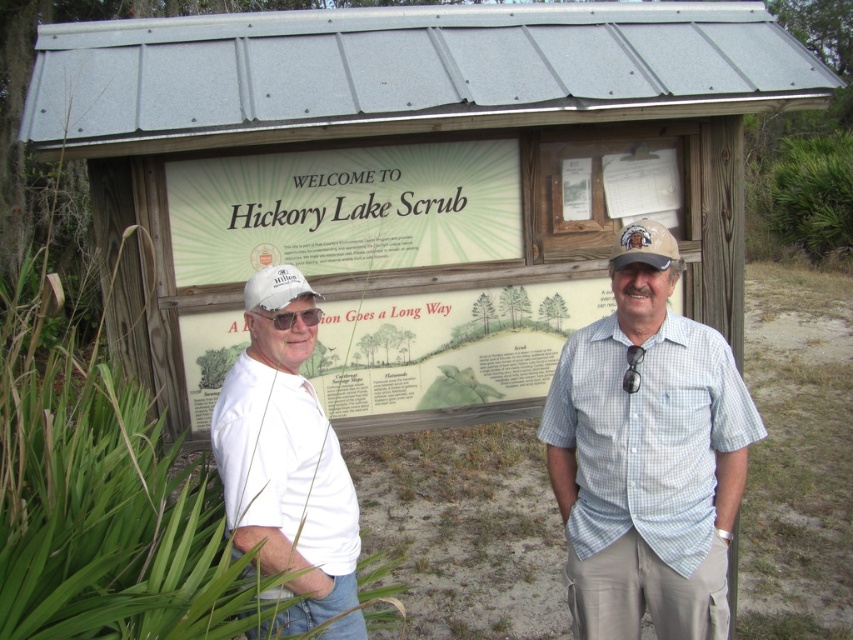
You are a photographer trying to capture both the white matte baseball cap at left and the matte black goggles at center in the same frame. Which object should you focus on first to ensure both are in focus?

You should focus on the white matte baseball cap at left first because it is closer to the viewer than the matte black goggles at center, so adjusting focus from near to far will help both objects be in focus.

You are a photographer trying to capture a wide shot of the scene. The white matte baseball cap at left and the matte black goggles at center are both in the frame. If you want to ensure both items are fully visible without cropping, which object requires more space horizontally?

The white matte baseball cap at left requires more horizontal space because its width is larger than the matte black goggles at center.

You are a photographer trying to capture a photo of the white matte baseball cap at left and the matte black goggles at center. Which object should you focus on first if you want to include both in your frame without moving the camera?

You should focus on the matte black goggles at center first because the white matte baseball cap at left is to the left of matte black goggles at center, so keeping the goggles centered will ensure both objects remain in frame.